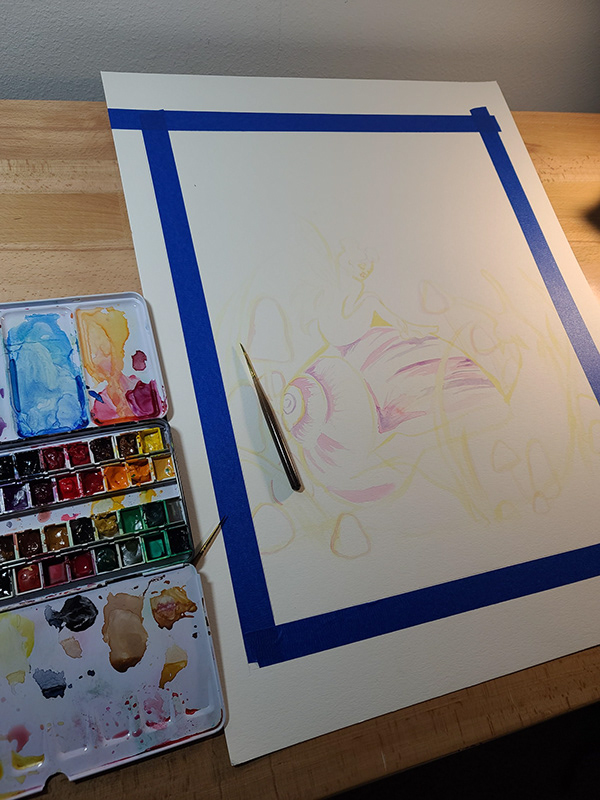
Find the location of a particular element. The width and height of the screenshot is (600, 800). desktop is located at coordinates (45, 228).